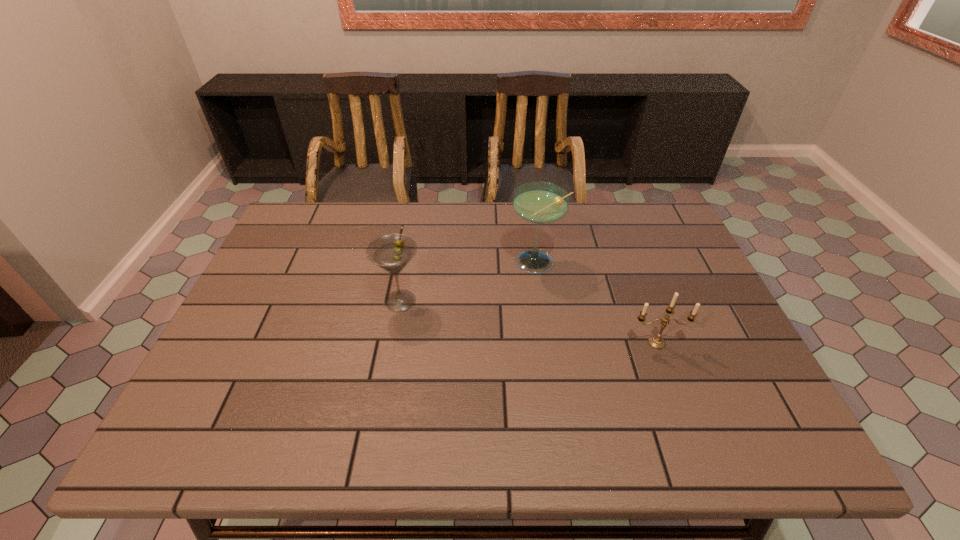
The image size is (960, 540). What are the coordinates of `the right martini` in the screenshot? It's located at (540, 203).

Image resolution: width=960 pixels, height=540 pixels. What are the coordinates of `the second object from left to right` in the screenshot? It's located at (540, 203).

Locate an element on the screen. Image resolution: width=960 pixels, height=540 pixels. the second shortest object is located at coordinates (392, 252).

The height and width of the screenshot is (540, 960). Find the location of `the shorter martini`. the shorter martini is located at coordinates (392, 252).

The width and height of the screenshot is (960, 540). Identify the location of the nearest object. tap(656, 342).

The width and height of the screenshot is (960, 540). I want to click on the rightmost object, so click(656, 342).

The width and height of the screenshot is (960, 540). I want to click on free region located on the left of the farther martini, so click(392, 264).

Find the location of a particular element. free space located 0.110m on the left of the left martini is located at coordinates (336, 301).

Identify the location of vacant space located 0.260m on the back of the rightmost object. (628, 266).

The image size is (960, 540). Find the location of `object that is positioned at the far edge`. object that is positioned at the far edge is located at coordinates (540, 203).